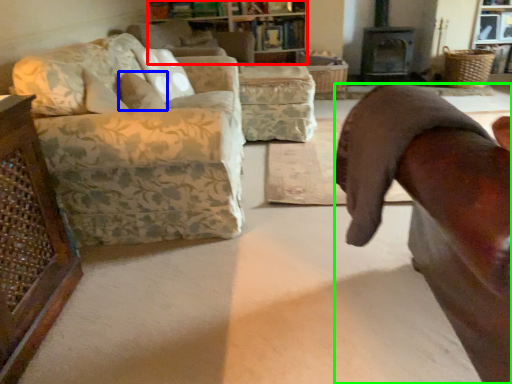
Question: Which is nearer to the cabinetry (highlighted by a red box)? pillow (highlighted by a blue box) or chair (highlighted by a green box).

Choices:
 (A) pillow
 (B) chair

Answer: (A)